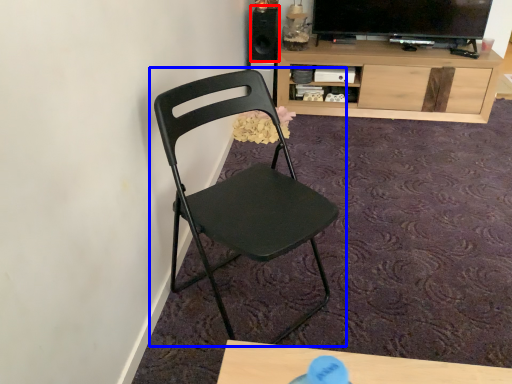
Question: Among these objects, which one is farthest to the camera, speaker (highlighted by a red box) or chair (highlighted by a blue box)?

Choices:
 (A) speaker
 (B) chair

Answer: (A)